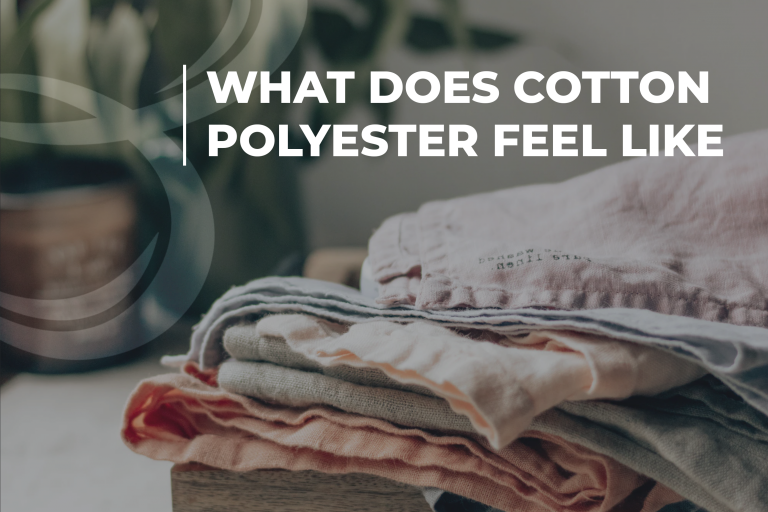
Locate an element on the screen. The width and height of the screenshot is (768, 512). basket is located at coordinates (97, 211).